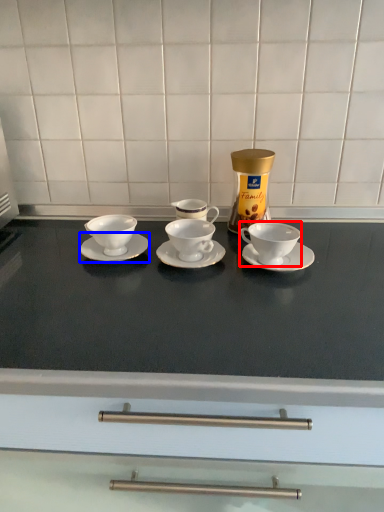
Question: Which object appears farthest to the camera in this image, coffee cup (highlighted by a red box) or saucer (highlighted by a blue box)?

Choices:
 (A) coffee cup
 (B) saucer

Answer: (B)